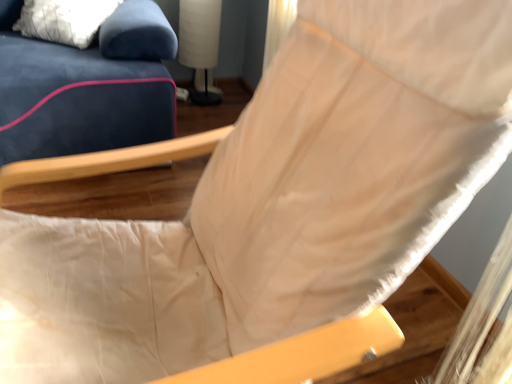
Where is `white textured pillow at upper left`? white textured pillow at upper left is located at coordinates (64, 20).

Describe the element at coordinates (64, 20) in the screenshot. I see `white textured pillow at upper left` at that location.

What do you see at coordinates (200, 42) in the screenshot? I see `white fabric lampshade at upper center` at bounding box center [200, 42].

The width and height of the screenshot is (512, 384). Find the location of `white fabric lampshade at upper center`. white fabric lampshade at upper center is located at coordinates (200, 42).

You are a GUI agent. You are given a task and a screenshot of the screen. Output one action in this format:
    pyautogui.click(x=<x>, y=<y>)
    Task: Click on the white textured pillow at upper left
    This screenshot has width=512, height=384.
    Given the screenshot: What is the action you would take?
    pyautogui.click(x=64, y=20)

In the image, is white fabric lampshade at upper center on the left side or the right side of white textured pillow at upper left?

Clearly, white fabric lampshade at upper center is on the right of white textured pillow at upper left in the image.

Is white fabric lampshade at upper center positioned before white textured pillow at upper left?

No, white fabric lampshade at upper center is further to the viewer.

Is point (195, 31) positioned in front of point (68, 39)?

No, (195, 31) is further to viewer.

From the image's perspective, between white fabric lampshade at upper center and white textured pillow at upper left, which one is located above?

white fabric lampshade at upper center.

From a real-world perspective, is white fabric lampshade at upper center on white textured pillow at upper left?

No, from a real-world perspective, white fabric lampshade at upper center is not above white textured pillow at upper left.

Can you confirm if white fabric lampshade at upper center is thinner than white textured pillow at upper left?

Yes, white fabric lampshade at upper center is thinner than white textured pillow at upper left.

Which of these two, white fabric lampshade at upper center or white textured pillow at upper left, stands taller?

white fabric lampshade at upper center.

In terms of size, does white fabric lampshade at upper center appear bigger or smaller than white textured pillow at upper left?

In the image, white fabric lampshade at upper center appears to be smaller than white textured pillow at upper left.

Choose the correct answer: Is white fabric lampshade at upper center inside white textured pillow at upper left or outside it?

white fabric lampshade at upper center is not inside white textured pillow at upper left, it's outside.

Is there a large distance between white fabric lampshade at upper center and white textured pillow at upper left?

No, white fabric lampshade at upper center is not far from white textured pillow at upper left.

Could you tell me if white fabric lampshade at upper center is turned towards white textured pillow at upper left?

Yes, white fabric lampshade at upper center is facing white textured pillow at upper left.

The height and width of the screenshot is (384, 512). Find the location of `pillow above the white fabric lampshade at upper center (from a real-world perspective)`. pillow above the white fabric lampshade at upper center (from a real-world perspective) is located at coordinates (64, 20).

Does white textured pillow at upper left appear on the right side of white fabric lampshade at upper center?

No, white textured pillow at upper left is not to the right of white fabric lampshade at upper center.

Between white textured pillow at upper left and white fabric lampshade at upper center, which one is positioned behind?

white fabric lampshade at upper center is further from the camera.

Which point is more distant from viewer, (40, 7) or (193, 66)?

Point (193, 66)

From the image's perspective, is white textured pillow at upper left located above white fabric lampshade at upper center?

Actually, white textured pillow at upper left appears below white fabric lampshade at upper center in the image.

From a real-world perspective, is white textured pillow at upper left located higher than white fabric lampshade at upper center?

Correct, in the physical world, white textured pillow at upper left is higher than white fabric lampshade at upper center.

Considering the sizes of objects white textured pillow at upper left and white fabric lampshade at upper center in the image provided, who is thinner, white textured pillow at upper left or white fabric lampshade at upper center?

white fabric lampshade at upper center.

Can you confirm if white textured pillow at upper left is shorter than white fabric lampshade at upper center?

Indeed, white textured pillow at upper left has a lesser height compared to white fabric lampshade at upper center.

Who is bigger, white textured pillow at upper left or white fabric lampshade at upper center?

white textured pillow at upper left.

Is white fabric lampshade at upper center surrounded by white textured pillow at upper left?

No.

Would you say white textured pillow at upper left is a long distance from white fabric lampshade at upper center?

That's not correct — white textured pillow at upper left is a little close to white fabric lampshade at upper center.

Could you tell me if white textured pillow at upper left is facing white fabric lampshade at upper center?

No, white textured pillow at upper left is not turned towards white fabric lampshade at upper center.

How many degrees apart are the facing directions of white textured pillow at upper left and white fabric lampshade at upper center?

The facing directions of white textured pillow at upper left and white fabric lampshade at upper center are 42.2 degrees apart.

Locate an element on the screen. The width and height of the screenshot is (512, 384). pillow that appears below the white fabric lampshade at upper center (from the image's perspective) is located at coordinates (64, 20).

Locate an element on the screen. table lamp behind the white textured pillow at upper left is located at coordinates (200, 42).

Find the location of `pillow above the white fabric lampshade at upper center (from a real-world perspective)`. pillow above the white fabric lampshade at upper center (from a real-world perspective) is located at coordinates (64, 20).